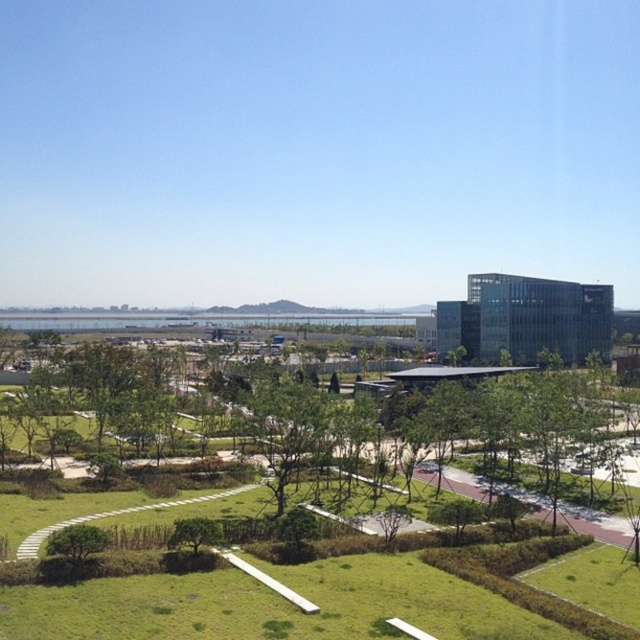
Question: Is green grassy park at center in front of green leafy tree at lower center?

Choices:
 (A) yes
 (B) no

Answer: (A)

Question: Which point is farther from the camera taking this photo?

Choices:
 (A) (180, 540)
 (B) (364, 632)

Answer: (A)

Question: Considering the real-world distances, which object is closest to the green leafy tree at lower center?

Choices:
 (A) green leafy tree at lower left
 (B) green grassy park at center

Answer: (A)

Question: Which object appears farthest from the camera in this image?

Choices:
 (A) green grassy park at center
 (B) green leafy tree at lower center
 (C) green leafy tree at lower left

Answer: (B)

Question: Does green grassy park at center have a larger size compared to green leafy tree at lower center?

Choices:
 (A) no
 (B) yes

Answer: (B)

Question: Does green grassy park at center appear over green leafy tree at lower left?

Choices:
 (A) yes
 (B) no

Answer: (A)